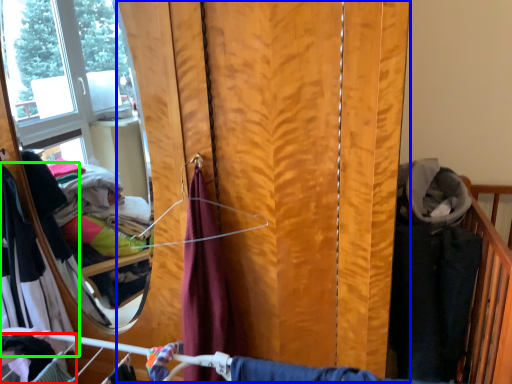
Question: Based on their relative distances, which object is nearer to clothing (highlighted by a red box)? Choose from curtain (highlighted by a blue box) and clothing (highlighted by a green box).

Choices:
 (A) curtain
 (B) clothing

Answer: (B)